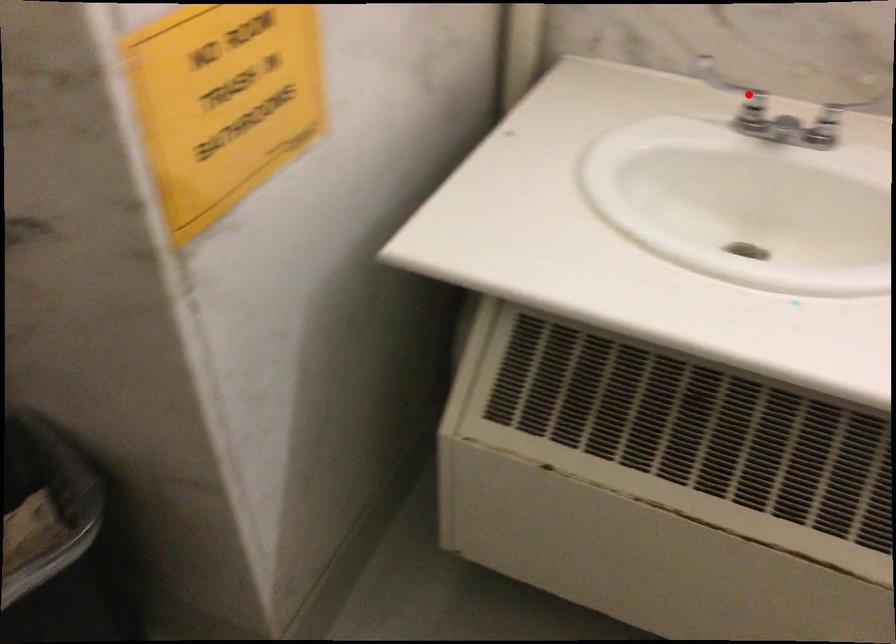
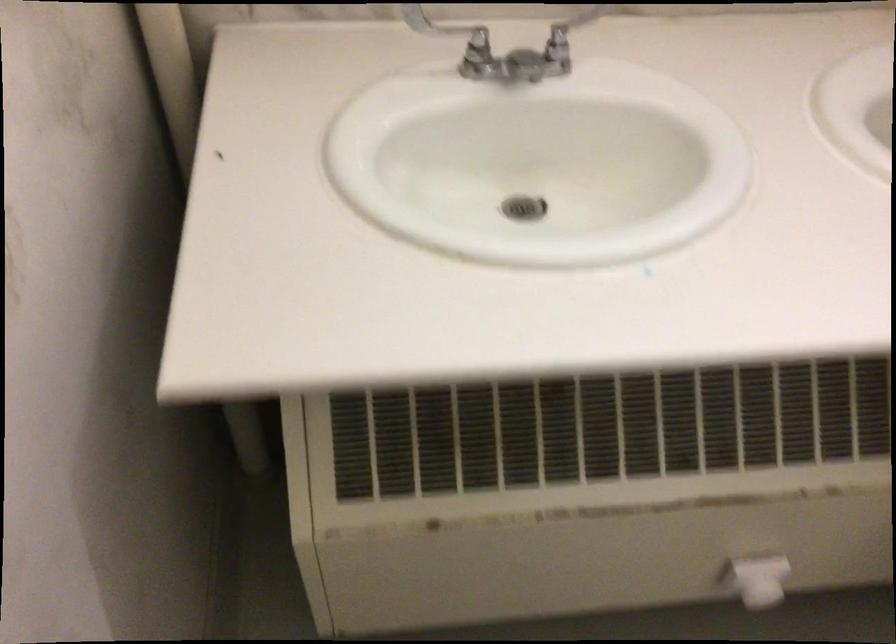
Find the pixel in the second image that matches the highlighted location in the first image.

(476, 37)